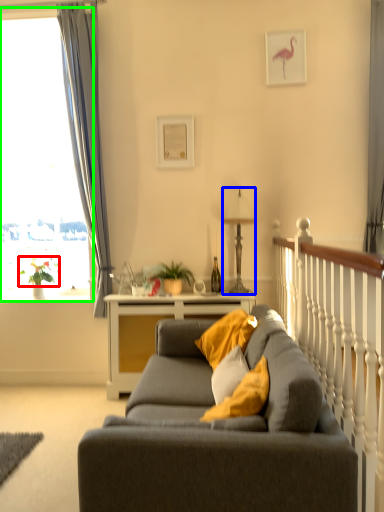
Question: Based on their relative distances, which object is farther from plant (highlighted by a red box)? Choose from lamp (highlighted by a blue box) and bay window (highlighted by a green box).

Choices:
 (A) lamp
 (B) bay window

Answer: (A)